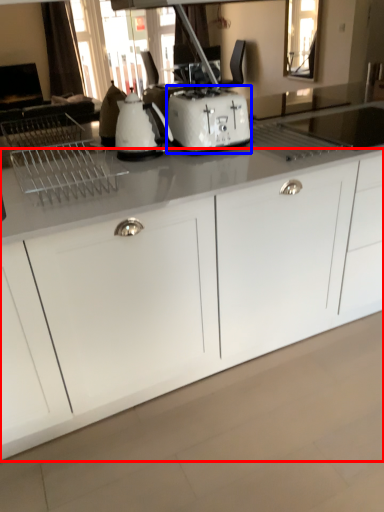
Question: Among these objects, which one is nearest to the camera, cabinetry (highlighted by a red box) or toaster (highlighted by a blue box)?

Choices:
 (A) cabinetry
 (B) toaster

Answer: (A)